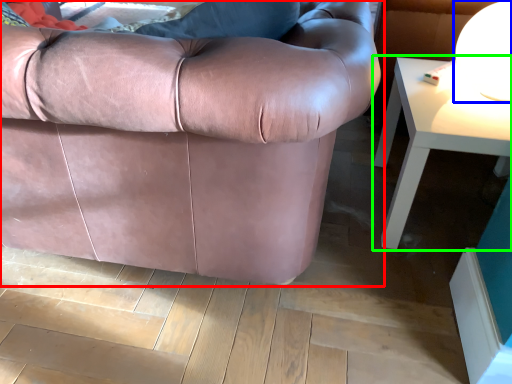
Question: Which is nearer to the studio couch (highlighted by a red box)? table lamp (highlighted by a blue box) or table (highlighted by a green box).

Choices:
 (A) table lamp
 (B) table

Answer: (B)